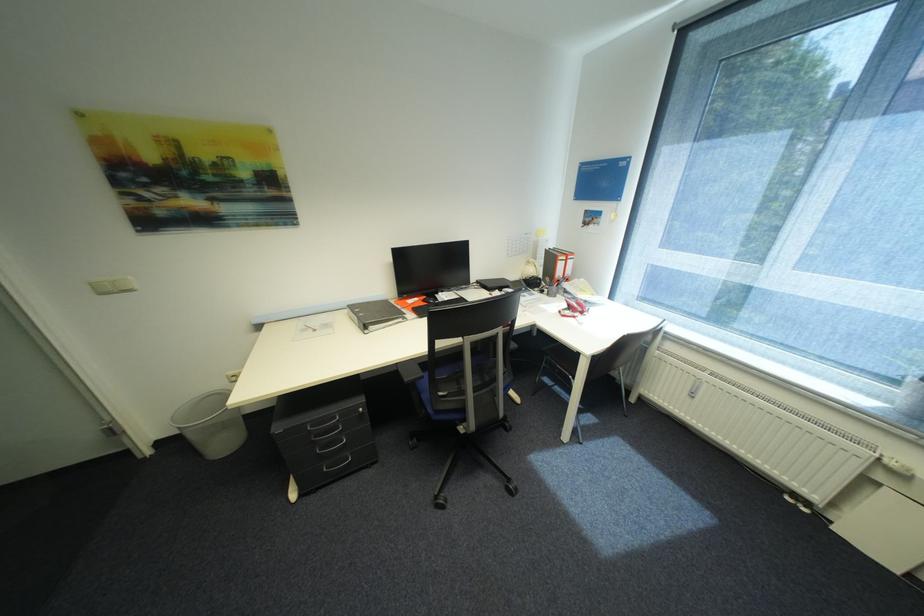
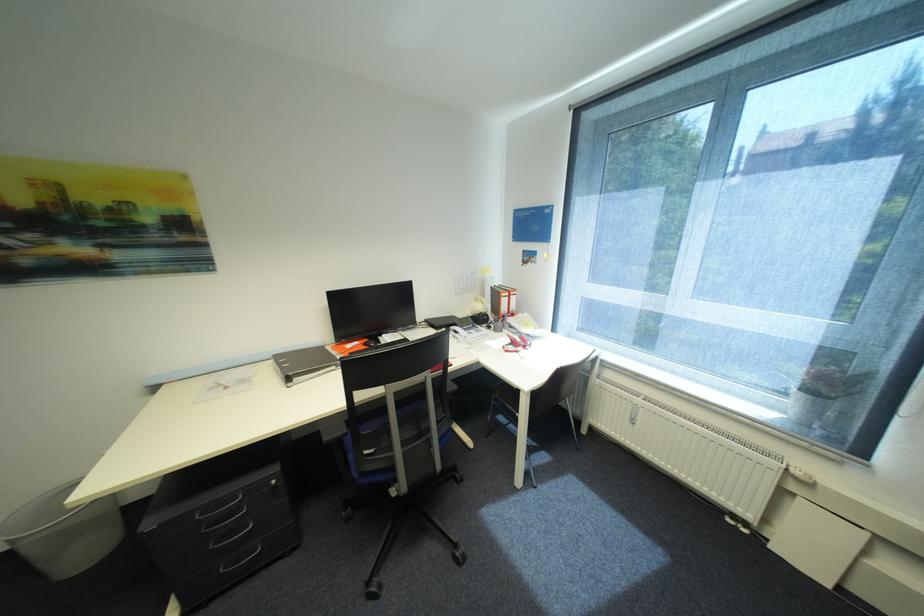
Locate, in the second image, the point that corresponds to pixel 577 299 in the first image.

(521, 333)